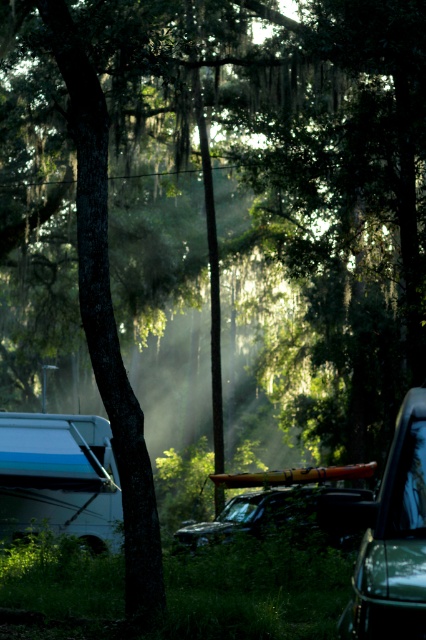
Question: Which point is closer to the camera taking this photo?

Choices:
 (A) (77, 458)
 (B) (255, 502)

Answer: (B)

Question: Can you confirm if blue metallic camper at lower left is positioned to the left of shiny black suv at center?

Choices:
 (A) no
 (B) yes

Answer: (B)

Question: Which of the following is the farthest from the observer?

Choices:
 (A) shiny black suv at center
 (B) blue metallic camper at lower left

Answer: (B)

Question: Which is nearer to the metallic green car at right?

Choices:
 (A) blue metallic camper at lower left
 (B) shiny black suv at center

Answer: (B)

Question: Can you confirm if metallic green car at right is positioned above shiny black suv at center?

Choices:
 (A) yes
 (B) no

Answer: (A)

Question: Is blue metallic camper at lower left wider than metallic green car at right?

Choices:
 (A) no
 (B) yes

Answer: (B)